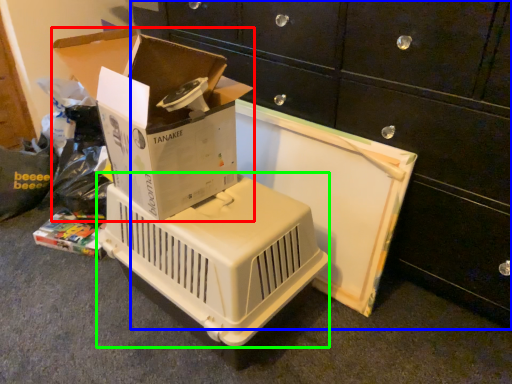
Question: Estimate the real-world distances between objects in this image. Which object is farther from box (highlighted by a red box), furniture (highlighted by a blue box) or appliance (highlighted by a green box)?

Choices:
 (A) furniture
 (B) appliance

Answer: (A)